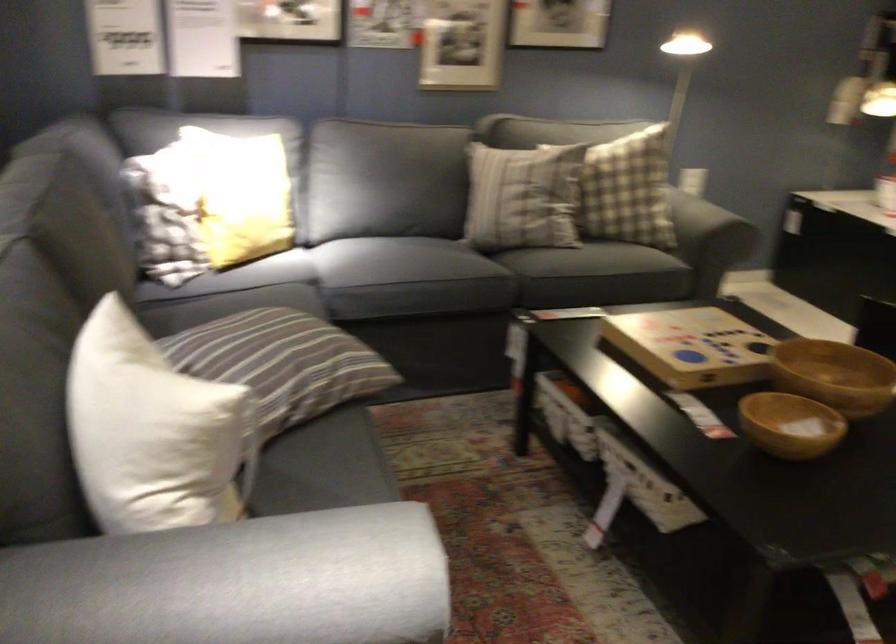
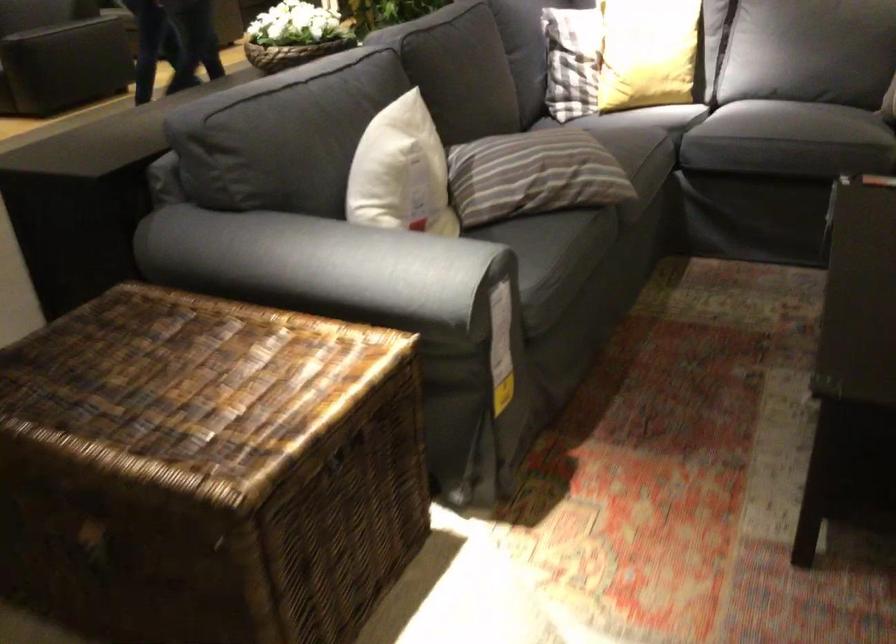
Where in the second image is the point corresponding to [212,223] from the first image?

(572, 61)